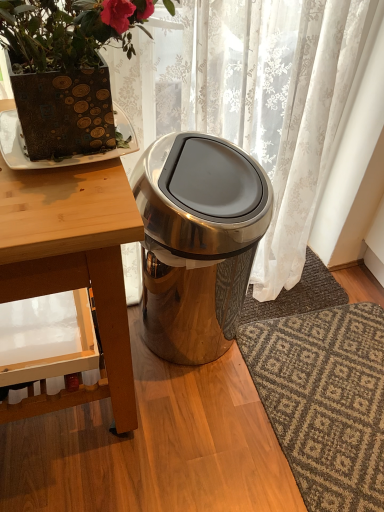
What are the coordinates of `free area in between brown textured rug at lower right, the first doormat positioned from the bottom, and satin silver trash can at center` in the screenshot? It's located at (244, 392).